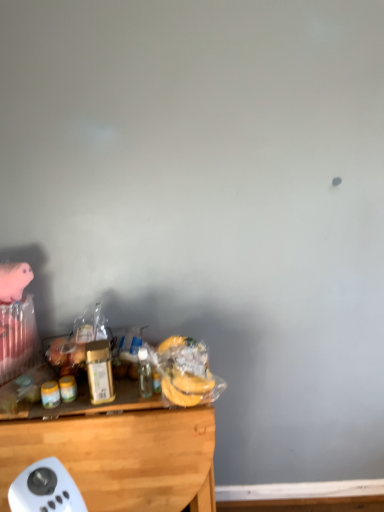
The image size is (384, 512). I want to click on free space that is in between yellow matte jar at left, the 2th food viewed from the right, and translucent plastic bottle at center, the 2th bottle in the left-to-right sequence, so click(108, 399).